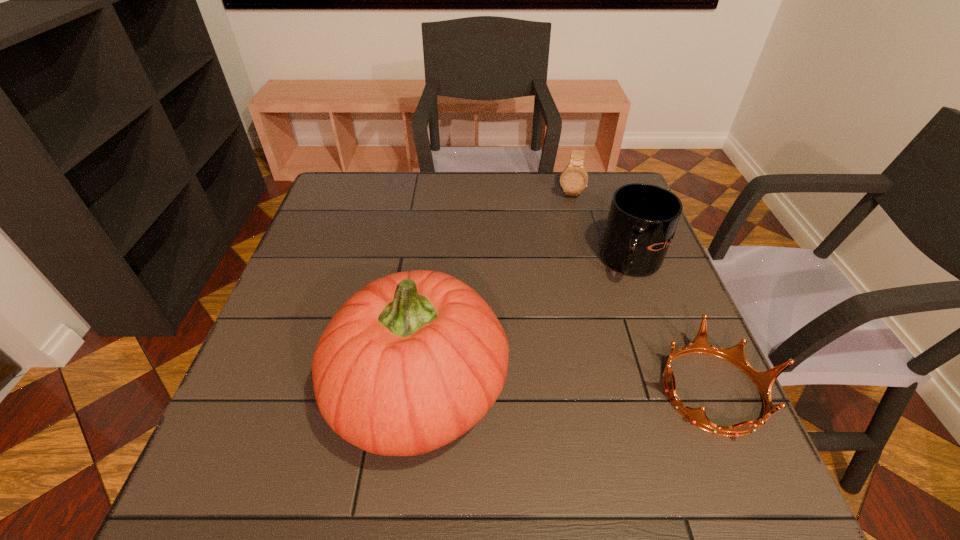
You are a GUI agent. You are given a task and a screenshot of the screen. Output one action in this format:
    pyautogui.click(x=<x>, y=<y>)
    Task: Click on the free space between the second farthest object and the tallest object
    The width and height of the screenshot is (960, 540).
    Given the screenshot: What is the action you would take?
    pyautogui.click(x=526, y=327)

Find the location of a particular element. This screenshot has width=960, height=540. free space between the mug and the second shortest object is located at coordinates (601, 228).

You are a GUI agent. You are given a task and a screenshot of the screen. Output one action in this format:
    pyautogui.click(x=<x>, y=<y>)
    Task: Click on the free space between the watch and the crown
    
    Given the screenshot: What is the action you would take?
    pyautogui.click(x=641, y=292)

This screenshot has height=540, width=960. What are the coordinates of `free area in between the tallest object and the watch` in the screenshot? It's located at (493, 292).

Identify the location of vacant area between the second farthest object and the leftmost object. (526, 327).

What are the coordinates of `free space between the shortest object and the tallest object` in the screenshot? It's located at (565, 390).

Where is `free space between the tallest object and the shortest object`? free space between the tallest object and the shortest object is located at coordinates (565, 390).

Identify the location of object that can be found as the closest to the crown. (641, 224).

In order to click on object that is the second closest to the leftmost object in this screenshot , I will do `click(764, 381)`.

Identify the location of vacant point that satisfies the following two spatial constraints: 1. on the front side of the shortest object; 2. on the right side of the tallest object. (419, 391).